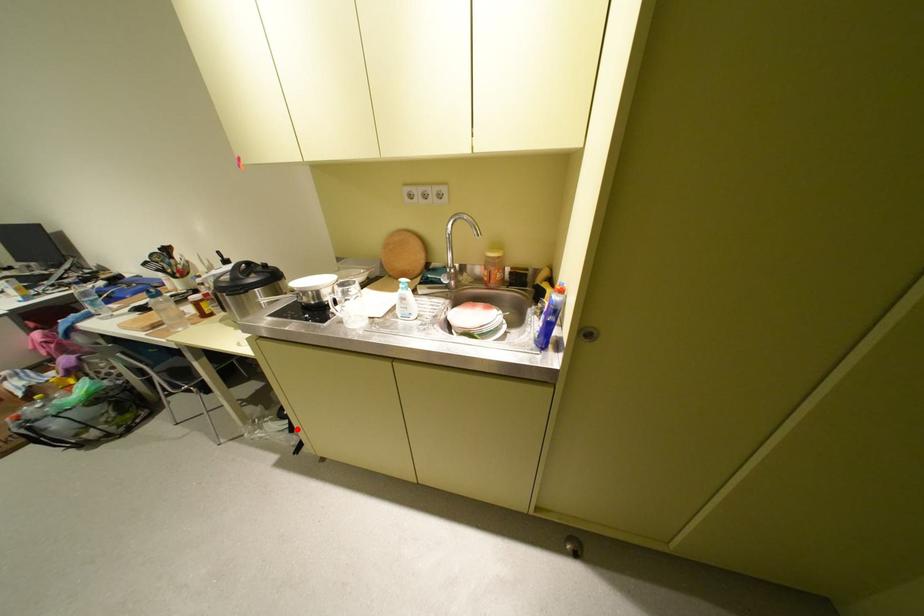
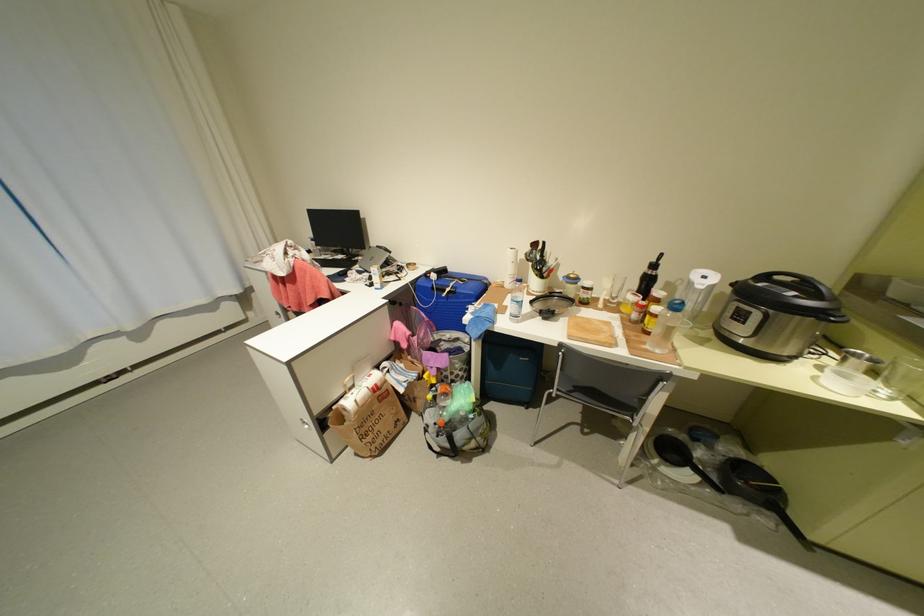
Question: I am providing you with two images of the same scene from different viewpoints. Image1 has a red point marked. In image2, the corresponding 3D location appears at what relative position? Reply with the corresponding letter.

Choices:
 (A) Closer
 (B) Farther

Answer: (B)